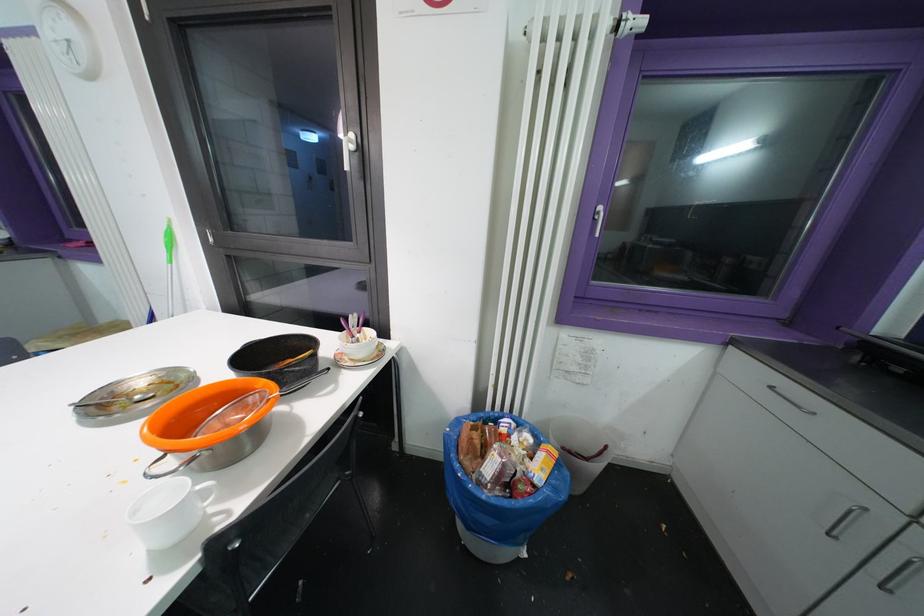
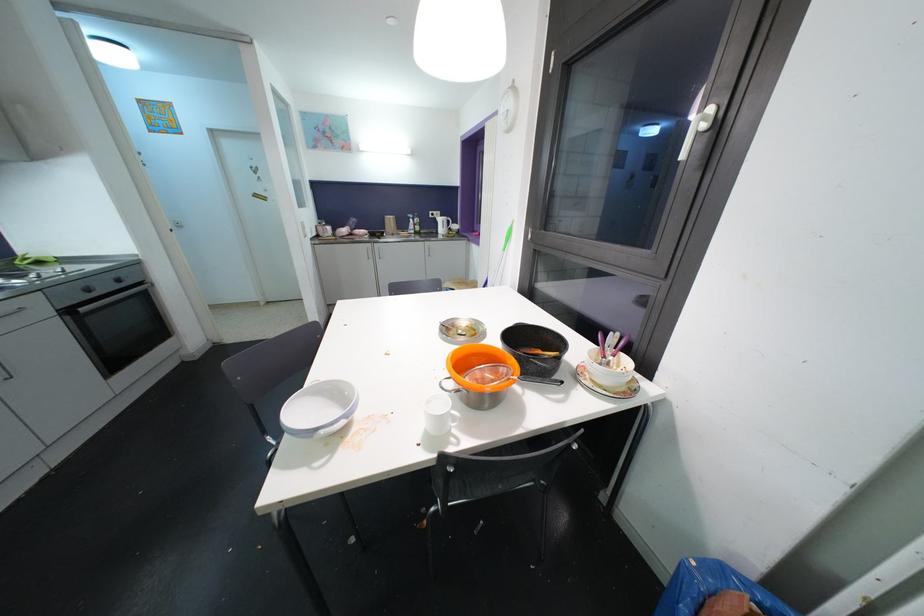
In the second image, find the point that corresponds to point 195,463 in the first image.

(460, 392)